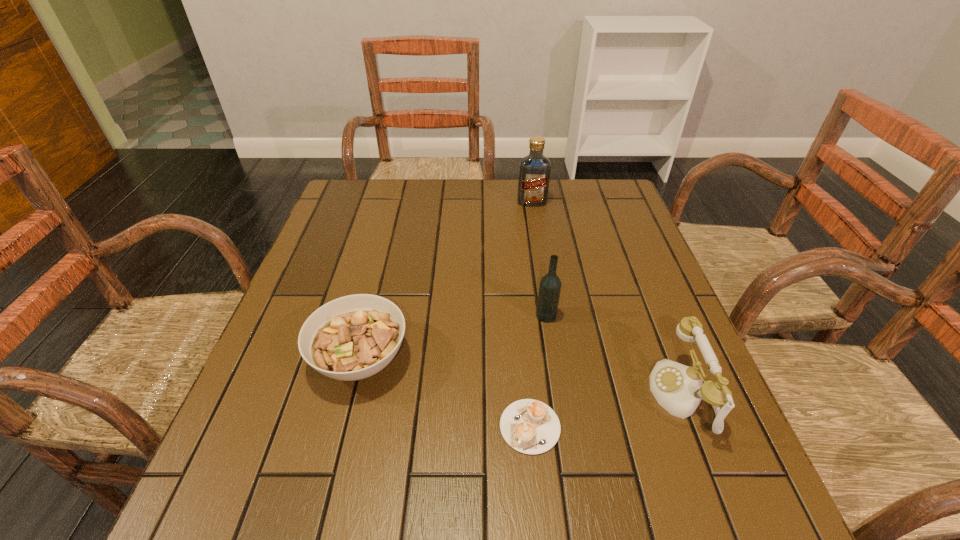
At what (x,y) coordinates should I click in order to perform the action: click on the farthest object. Please return your answer as a coordinate pair (x, y). The image size is (960, 540). Looking at the image, I should click on (534, 170).

In order to click on the taller vodka in this screenshot , I will do `click(534, 170)`.

Locate an element on the screen. the shorter vodka is located at coordinates (550, 284).

Locate an element on the screen. the second tallest object is located at coordinates (550, 284).

Locate an element on the screen. the rightmost object is located at coordinates (679, 389).

This screenshot has height=540, width=960. I want to click on the third shortest object, so [x=679, y=389].

The width and height of the screenshot is (960, 540). In order to click on the fourth tallest object in this screenshot , I will do `click(353, 337)`.

Where is `the leftmost object`? the leftmost object is located at coordinates (353, 337).

At what (x,y) coordinates should I click in order to perform the action: click on cappuccino. Please return your answer as a coordinate pair (x, y). This screenshot has width=960, height=540. Looking at the image, I should click on (529, 426).

Where is `free location located 0.090m on the front-facing side of the farther vodka`? free location located 0.090m on the front-facing side of the farther vodka is located at coordinates (536, 225).